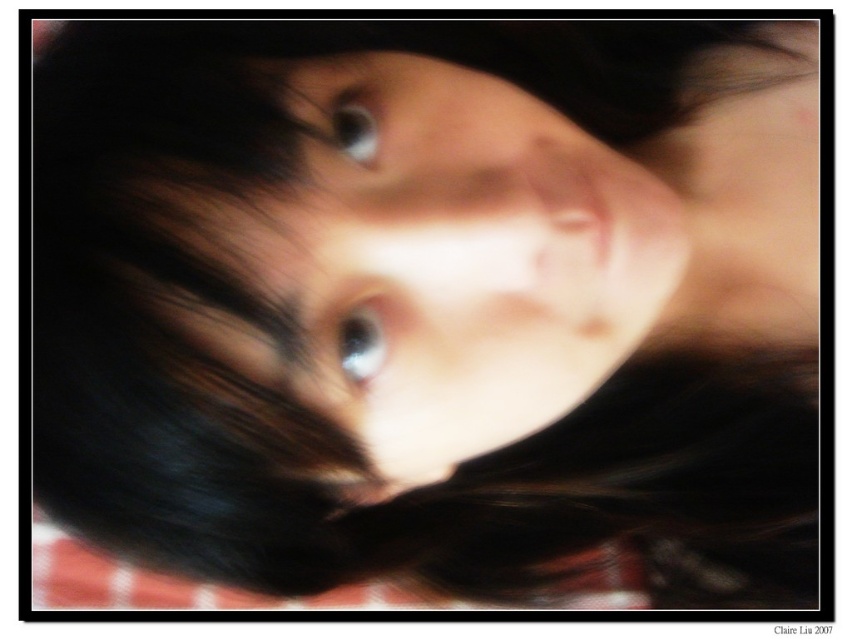
You are a photographer reviewing a blurred image of a person. The image has a point at coordinates point (361, 342). What object is located at that specific coordinate in the image?

The shiny blue eye at center is located at point (361, 342).

You are a photographer reviewing a blurred portrait. You notice two blue eyes in the image, labeled as the shiny blue eye at center and the blue glossy eye at center. Which eye appears closer to you?

The shiny blue eye at center appears closer to you because it is described as being closer to the viewer than the blue glossy eye at center.